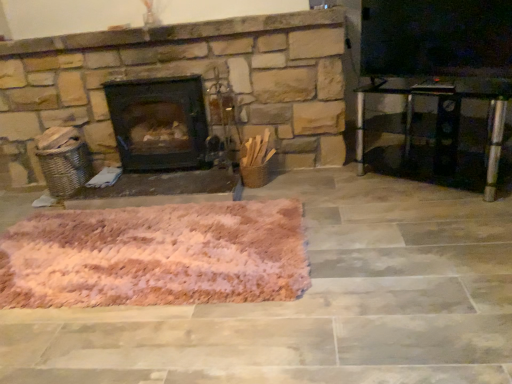
Question: From a real-world perspective, relative to black matte wood burning stove at center, is transparent glass table at right vertically above or below?

Choices:
 (A) below
 (B) above

Answer: (A)

Question: From the image's perspective, relative to black matte wood burning stove at center, is transparent glass table at right above or below?

Choices:
 (A) above
 (B) below

Answer: (B)

Question: Which of these objects is positioned closest to the black matte wood burning stove at center?

Choices:
 (A) pink fluffy rug at center
 (B) transparent glass table at right

Answer: (A)

Question: Considering the real-world distances, which object is farthest from the transparent glass table at right?

Choices:
 (A) pink fluffy rug at center
 (B) black matte wood burning stove at center

Answer: (A)